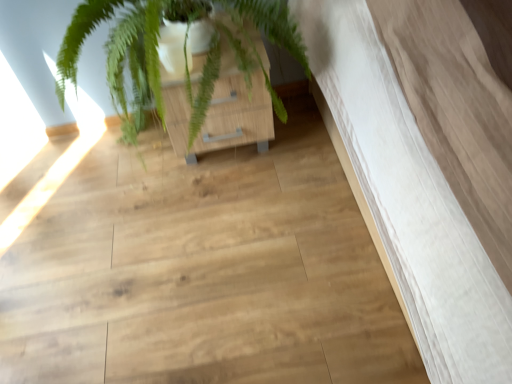
What do you see at coordinates (220, 110) in the screenshot? I see `wooden cabinet at center` at bounding box center [220, 110].

Locate an element on the screen. wooden cabinet at center is located at coordinates pyautogui.click(x=220, y=110).

This screenshot has width=512, height=384. What are the coordinates of `wooden cabinet at center` in the screenshot? It's located at (220, 110).